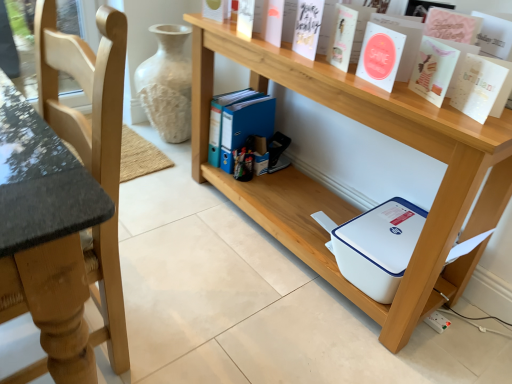
Find the location of a particular element. Image resolution: width=512 pixels, height=384 pixels. free space that is to the left of white matte paper at upper center, the fourth paperback book viewed from the right is located at coordinates (313, 62).